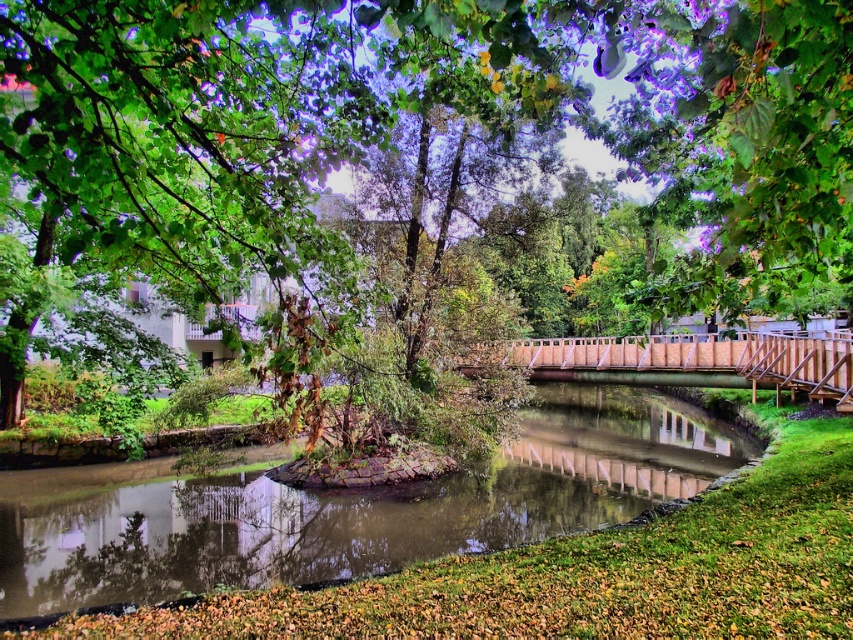
Does greenish murky water at center have a larger size compared to wooden bridge at center?

No.

This screenshot has width=853, height=640. In order to click on greenish murky water at center in this screenshot , I will do `click(361, 509)`.

Where is `greenish murky water at center`? greenish murky water at center is located at coordinates (361, 509).

Can you confirm if green leafy tree at center is taller than wooden bridge at center?

Yes.

Is green leafy tree at center shorter than wooden bridge at center?

No, green leafy tree at center is not shorter than wooden bridge at center.

This screenshot has height=640, width=853. Describe the element at coordinates (418, 173) in the screenshot. I see `green leafy tree at center` at that location.

This screenshot has width=853, height=640. I want to click on green leafy tree at center, so click(x=418, y=173).

Where is `green leafy tree at center`? The width and height of the screenshot is (853, 640). green leafy tree at center is located at coordinates tap(418, 173).

Consider the image. Who is shorter, green leafy tree at center or greenish murky water at center?

greenish murky water at center is shorter.

The width and height of the screenshot is (853, 640). Identify the location of green leafy tree at center. (418, 173).

Where is `green leafy tree at center`? This screenshot has width=853, height=640. green leafy tree at center is located at coordinates (418, 173).